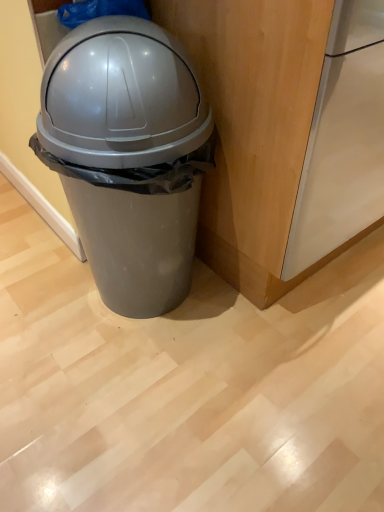
The image size is (384, 512). What do you see at coordinates (128, 156) in the screenshot?
I see `matte gray plastic trash can at center` at bounding box center [128, 156].

Identify the location of matte gray plastic trash can at center. Image resolution: width=384 pixels, height=512 pixels. (128, 156).

Locate an element on the screen. matte gray plastic trash can at center is located at coordinates (128, 156).